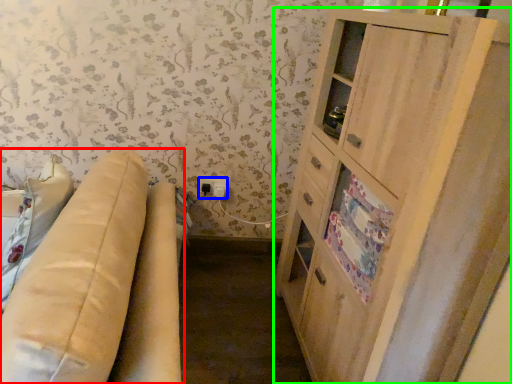
Question: Which is nearer to the studio couch (highlighted by a red box)? electric outlet (highlighted by a blue box) or cabinetry (highlighted by a green box).

Choices:
 (A) electric outlet
 (B) cabinetry

Answer: (B)